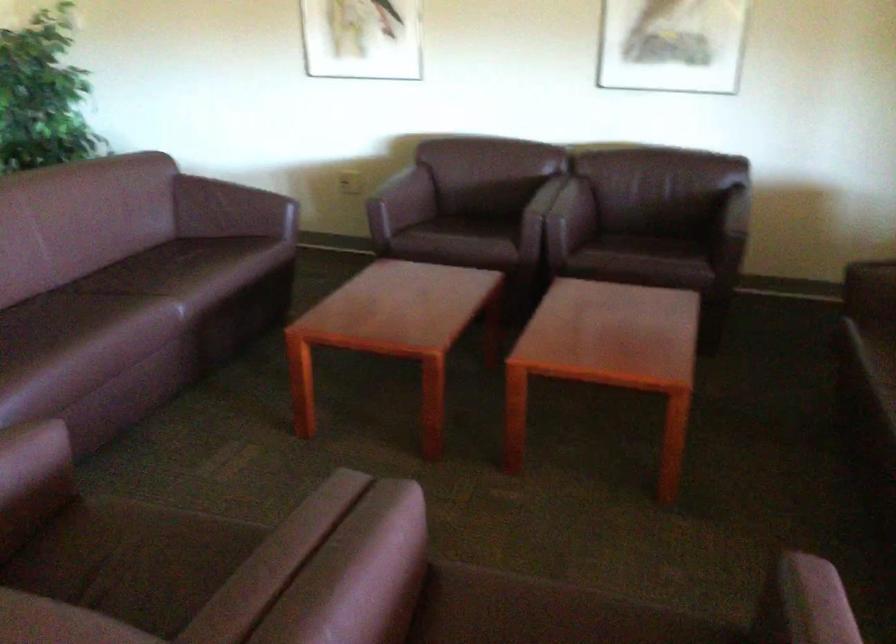
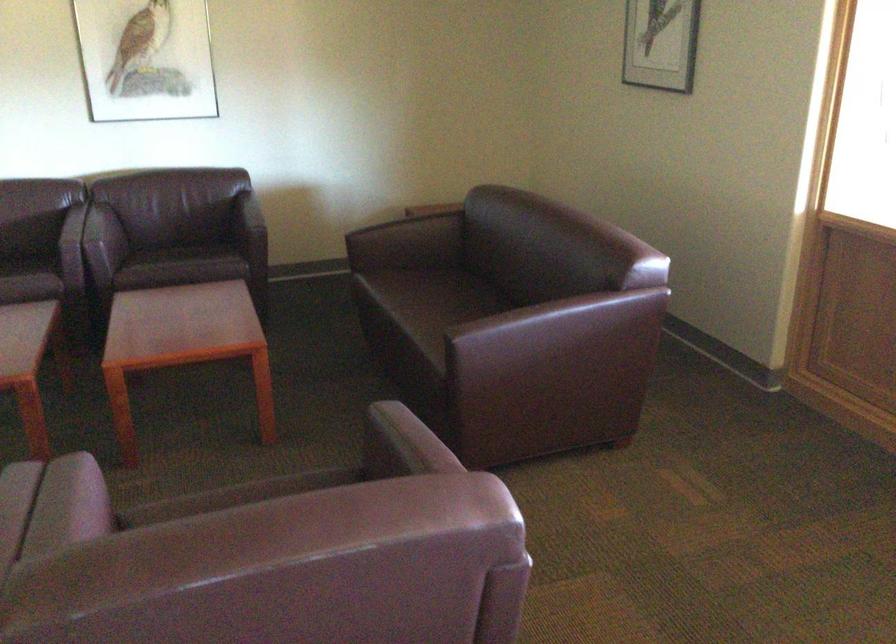
In the second image, find the point that corresponds to point (376, 562) in the first image.

(67, 506)